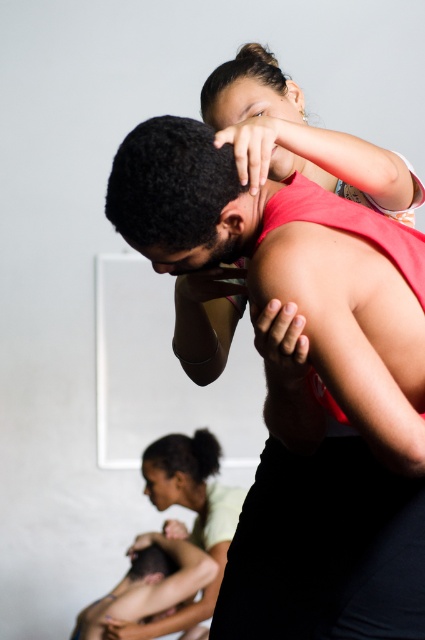
Question: Which of the following is the closest to the observer?

Choices:
 (A) (320, 157)
 (B) (271, 188)

Answer: (A)

Question: Among these points, which one is farthest from the camera?

Choices:
 (A) (252, 550)
 (B) (275, 81)

Answer: (B)

Question: Observing the image, what is the correct spatial positioning of matte red tank top at center in reference to matte pink tank top at upper center?

Choices:
 (A) above
 (B) below

Answer: (B)

Question: Does matte red tank top at center have a lesser width compared to matte pink tank top at upper center?

Choices:
 (A) yes
 (B) no

Answer: (B)

Question: Which of the following is the farthest from the observer?

Choices:
 (A) (150, 259)
 (B) (303, 128)

Answer: (A)

Question: Does matte red tank top at center appear over matte pink tank top at upper center?

Choices:
 (A) no
 (B) yes

Answer: (A)